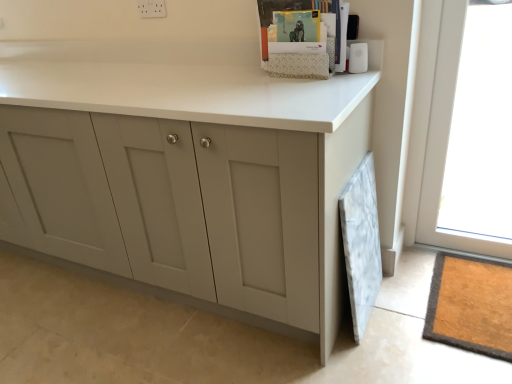
Question: Relative to transparent glass window at upper right, is matte gray cabinet at center in front or behind?

Choices:
 (A) front
 (B) behind

Answer: (A)

Question: In terms of size, does matte gray cabinet at center appear bigger or smaller than transparent glass window at upper right?

Choices:
 (A) big
 (B) small

Answer: (A)

Question: In the image, is matte gray cabinet at center on the left side or the right side of transparent glass window at upper right?

Choices:
 (A) left
 (B) right

Answer: (A)

Question: In terms of size, does transparent glass window at upper right appear bigger or smaller than matte gray cabinet at center?

Choices:
 (A) big
 (B) small

Answer: (B)

Question: In terms of height, does transparent glass window at upper right look taller or shorter compared to matte gray cabinet at center?

Choices:
 (A) short
 (B) tall

Answer: (B)

Question: Is transparent glass window at upper right spatially inside matte gray cabinet at center, or outside of it?

Choices:
 (A) inside
 (B) outside

Answer: (B)

Question: In the image, is transparent glass window at upper right positioned in front of or behind matte gray cabinet at center?

Choices:
 (A) front
 (B) behind

Answer: (B)